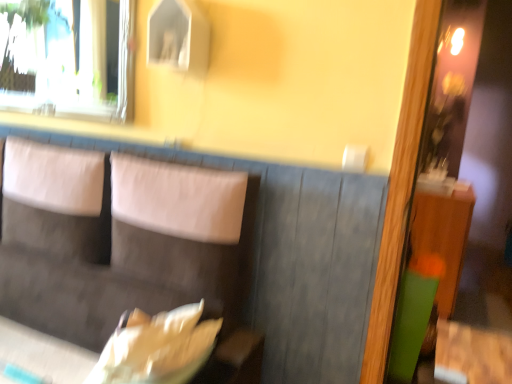
Question: Is transparent glass window at upper left in contact with suede-like gray couch at center?

Choices:
 (A) no
 (B) yes

Answer: (A)

Question: From the image's perspective, is transparent glass window at upper left beneath suede-like gray couch at center?

Choices:
 (A) yes
 (B) no

Answer: (B)

Question: Is transparent glass window at upper left wider than suede-like gray couch at center?

Choices:
 (A) yes
 (B) no

Answer: (B)

Question: From a real-world perspective, is transparent glass window at upper left positioned over suede-like gray couch at center based on gravity?

Choices:
 (A) no
 (B) yes

Answer: (B)

Question: Considering the relative positions of transparent glass window at upper left and suede-like gray couch at center in the image provided, is transparent glass window at upper left to the right of suede-like gray couch at center from the viewer's perspective?

Choices:
 (A) no
 (B) yes

Answer: (A)

Question: Is the position of transparent glass window at upper left more distant than that of suede-like gray couch at center?

Choices:
 (A) no
 (B) yes

Answer: (B)

Question: Is the position of suede-like gray couch at center less distant than that of transparent glass window at upper left?

Choices:
 (A) yes
 (B) no

Answer: (A)

Question: From the image's perspective, is suede-like gray couch at center located beneath transparent glass window at upper left?

Choices:
 (A) no
 (B) yes

Answer: (B)

Question: Can you confirm if suede-like gray couch at center is taller than transparent glass window at upper left?

Choices:
 (A) yes
 (B) no

Answer: (A)

Question: Considering the relative sizes of suede-like gray couch at center and transparent glass window at upper left in the image provided, is suede-like gray couch at center wider than transparent glass window at upper left?

Choices:
 (A) no
 (B) yes

Answer: (B)

Question: Is suede-like gray couch at center oriented away from transparent glass window at upper left?

Choices:
 (A) yes
 (B) no

Answer: (B)

Question: Considering the relative sizes of suede-like gray couch at center and transparent glass window at upper left in the image provided, is suede-like gray couch at center smaller than transparent glass window at upper left?

Choices:
 (A) yes
 (B) no

Answer: (B)

Question: Visually, is transparent glass window at upper left positioned to the left or to the right of suede-like gray couch at center?

Choices:
 (A) right
 (B) left

Answer: (B)